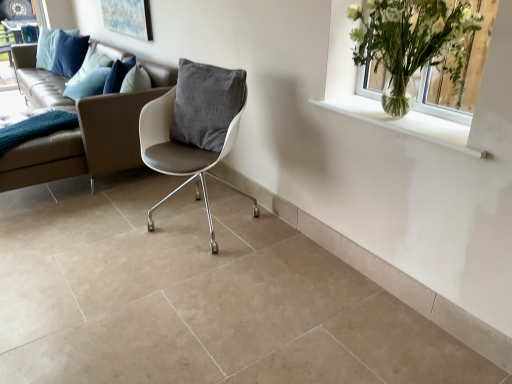
Locate an element on the screen. clear glass vase at upper right is located at coordinates (412, 42).

This screenshot has width=512, height=384. Find the location of `white leather chair at center`. white leather chair at center is located at coordinates (194, 127).

The width and height of the screenshot is (512, 384). I want to click on leather couch at center, so click(77, 127).

Is matte blue painting at upper left taller or shorter than matte glass window frame at upper left?

Clearly, matte blue painting at upper left is shorter compared to matte glass window frame at upper left.

From a real-world perspective, between matte blue painting at upper left and matte glass window frame at upper left, who is vertically lower?

matte glass window frame at upper left is physically lower.

How many degrees apart are the facing directions of matte blue painting at upper left and matte glass window frame at upper left?

The angle between the facing direction of matte blue painting at upper left and the facing direction of matte glass window frame at upper left is 91.4 degrees.

Between point (118, 25) and point (179, 112), which one is positioned behind?

The point (118, 25) is farther from the camera.

From the picture: Between matte blue painting at upper left and white leather chair at center, which one has less height?

With less height is matte blue painting at upper left.

Looking at this image, considering the sizes of objects matte blue painting at upper left and white leather chair at center in the image provided, who is thinner, matte blue painting at upper left or white leather chair at center?

matte blue painting at upper left is thinner.

You are a GUI agent. You are given a task and a screenshot of the screen. Output one action in this format:
    pyautogui.click(x=<x>, y=<y>)
    Task: Click on the chair lying in front of the matte blue painting at upper left
    
    Given the screenshot: What is the action you would take?
    pyautogui.click(x=194, y=127)

Considering the sizes of objects white leather chair at center and matte glass window frame at upper left in the image provided, who is wider, white leather chair at center or matte glass window frame at upper left?

white leather chair at center.

From a real-world perspective, does white leather chair at center stand above matte glass window frame at upper left?

No.

Does point (177, 126) appear closer or farther from the camera than point (39, 1)?

Point (177, 126) is positioned closer to the camera compared to point (39, 1).

Is white leather chair at center oriented towards matte glass window frame at upper left?

No.

Which of these two, clear glass vase at upper right or white leather chair at center, is wider?

With larger width is white leather chair at center.

Does clear glass vase at upper right have a lesser height compared to white leather chair at center?

Indeed, clear glass vase at upper right has a lesser height compared to white leather chair at center.

Is clear glass vase at upper right far from white leather chair at center?

No, clear glass vase at upper right is not far away from white leather chair at center.

From a real-world perspective, between clear glass vase at upper right and white leather chair at center, who is vertically higher?

In real-world perspective, clear glass vase at upper right is above.

Consider the image. Can you confirm if matte glass window frame at upper left is smaller than clear glass vase at upper right?

Correct, matte glass window frame at upper left occupies less space than clear glass vase at upper right.

From the image's perspective, is matte glass window frame at upper left above or below clear glass vase at upper right?

Clearly, from the image's perspective, matte glass window frame at upper left is above clear glass vase at upper right.

Can you confirm if matte glass window frame at upper left is thinner than clear glass vase at upper right?

Yes.

Between clear glass vase at upper right and white leather chair at center, which one has less height?

With less height is clear glass vase at upper right.

Is clear glass vase at upper right touching white leather chair at center?

No, clear glass vase at upper right is not beside white leather chair at center.

Looking at their sizes, would you say clear glass vase at upper right is wider or thinner than white leather chair at center?

clear glass vase at upper right is thinner than white leather chair at center.

In the scene shown: Which of these two, clear glass vase at upper right or white leather chair at center, is bigger?

Bigger between the two is white leather chair at center.

Considering the sizes of objects leather couch at center and clear glass vase at upper right in the image provided, who is taller, leather couch at center or clear glass vase at upper right?

leather couch at center.

Between leather couch at center and clear glass vase at upper right, which one appears on the left side from the viewer's perspective?

leather couch at center.

How far apart are leather couch at center and clear glass vase at upper right?

leather couch at center is 5.47 feet from clear glass vase at upper right.

Where is `window frame behind the matte blue painting at upper left`? Image resolution: width=512 pixels, height=384 pixels. window frame behind the matte blue painting at upper left is located at coordinates pyautogui.click(x=9, y=11).

At what (x,y) coordinates should I click in order to perform the action: click on picture frame located above the white leather chair at center (from the image's perspective). Please return your answer as a coordinate pair (x, y). The height and width of the screenshot is (384, 512). Looking at the image, I should click on (128, 18).

From the image, which object appears to be farther from leather couch at center, clear glass vase at upper right or matte blue painting at upper left?

clear glass vase at upper right lies further to leather couch at center than the other object.

When comparing their distances from leather couch at center, does matte blue painting at upper left or clear glass vase at upper right seem closer?

Among the two, matte blue painting at upper left is located nearer to leather couch at center.

From the image, which object appears to be nearer to clear glass vase at upper right, clear glass vase at upper right or matte blue painting at upper left?

clear glass vase at upper right is positioned closer to the anchor clear glass vase at upper right.

Based on their spatial positions, is clear glass vase at upper right or matte blue painting at upper left closer to matte glass window frame at upper left?

matte blue painting at upper left.

Which object lies nearer to the anchor point white leather chair at center, clear glass vase at upper right or matte blue painting at upper left?

Based on the image, clear glass vase at upper right appears to be nearer to white leather chair at center.

Considering their positions, is clear glass vase at upper right positioned further to matte glass window frame at upper left than leather couch at center?

Among the two, clear glass vase at upper right is located further to matte glass window frame at upper left.

Considering their positions, is white leather chair at center positioned further to clear glass vase at upper right than matte glass window frame at upper left?

The object further to clear glass vase at upper right is matte glass window frame at upper left.

Looking at the image, which one is located closer to matte glass window frame at upper left, clear glass vase at upper right or clear glass vase at upper right?

clear glass vase at upper right.

Identify the location of studio couch between clear glass vase at upper right and matte glass window frame at upper left in the front-back direction. (77, 127).

This screenshot has height=384, width=512. In order to click on houseplant situated between white leather chair at center and clear glass vase at upper right from left to right in this screenshot , I will do `click(412, 42)`.

The image size is (512, 384). I want to click on picture frame positioned between white leather chair at center and matte glass window frame at upper left from near to far, so click(128, 18).

Where is `chair between leather couch at center and clear glass vase at upper right from left to right`? The image size is (512, 384). chair between leather couch at center and clear glass vase at upper right from left to right is located at coordinates (194, 127).